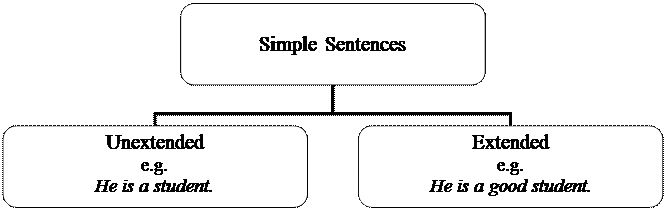
This screenshot has height=210, width=666. What are the coordinates of `box` in the screenshot? It's located at (437, 42).